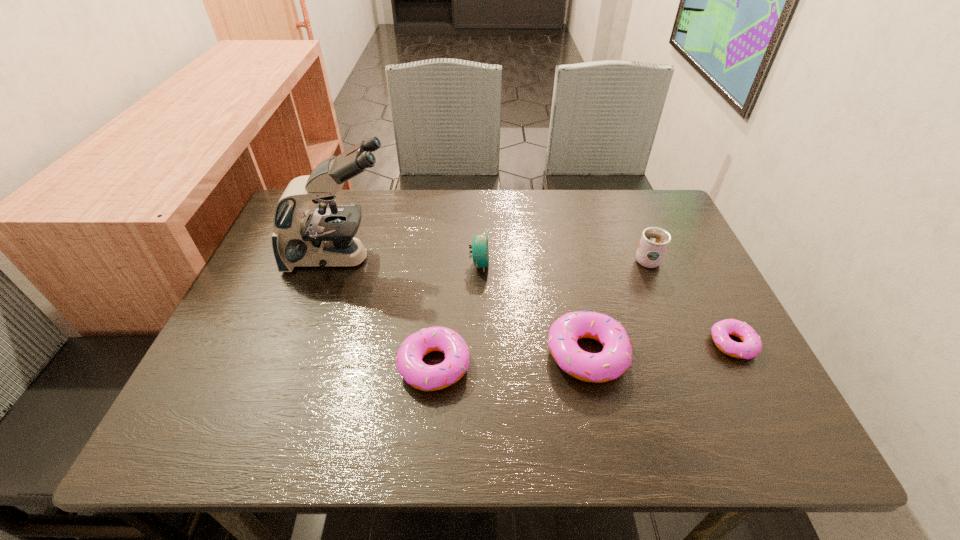
Identify which doughnut is the second nearest to the rightmost object. Please provide its 2D coordinates. Your answer should be formatted as a tuple, i.e. [(x, y)], where the tuple contains the x and y coordinates of a point satisfying the conditions above.

[(419, 375)]

Identify which doughnut is the second nearest to the shortest doughnut. Please provide its 2D coordinates. Your answer should be formatted as a tuple, i.e. [(x, y)], where the tuple contains the x and y coordinates of a point satisfying the conditions above.

[(419, 375)]

At what (x,y) coordinates should I click in order to perform the action: click on vacant space that satisfies the following two spatial constraints: 1. on the front-facing side of the alarm clock; 2. on the left side of the second doughnut from right to left. Please return your answer as a coordinate pair (x, y). This screenshot has width=960, height=540. Looking at the image, I should click on (479, 354).

Identify the location of vacant space that satisfies the following two spatial constraints: 1. on the back side of the shortest object; 2. through the eyepieces of the leftmost object. (689, 258).

Image resolution: width=960 pixels, height=540 pixels. I want to click on free space that satisfies the following two spatial constraints: 1. through the eyepieces of the leftmost object; 2. on the side with the handle of the cup, so click(341, 259).

The height and width of the screenshot is (540, 960). I want to click on free space that satisfies the following two spatial constraints: 1. on the front-facing side of the rightmost doughnut; 2. on the left side of the alarm clock, so pyautogui.click(x=479, y=344).

Identify the location of vacant space that satisfies the following two spatial constraints: 1. through the eyepieces of the leftmost object; 2. on the back side of the shortest object. (312, 344).

Image resolution: width=960 pixels, height=540 pixels. I want to click on free space that satisfies the following two spatial constraints: 1. through the eyepieces of the microscope; 2. on the left side of the leftmost doughnut, so click(x=305, y=365).

Where is `vacant space that satisfies the following two spatial constraints: 1. on the back side of the second doughnut from left to right; 2. on the left side of the shortest object`? The image size is (960, 540). vacant space that satisfies the following two spatial constraints: 1. on the back side of the second doughnut from left to right; 2. on the left side of the shortest object is located at coordinates (585, 344).